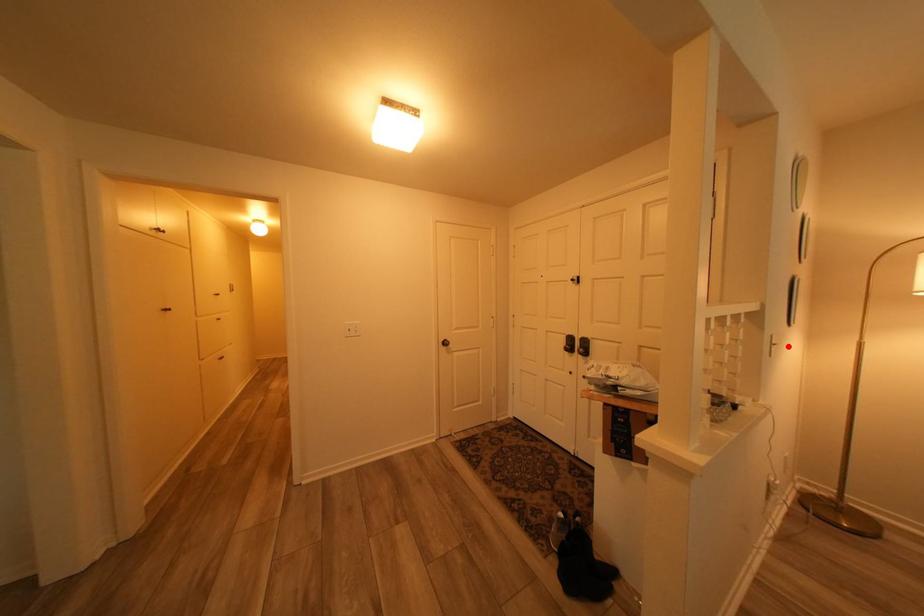
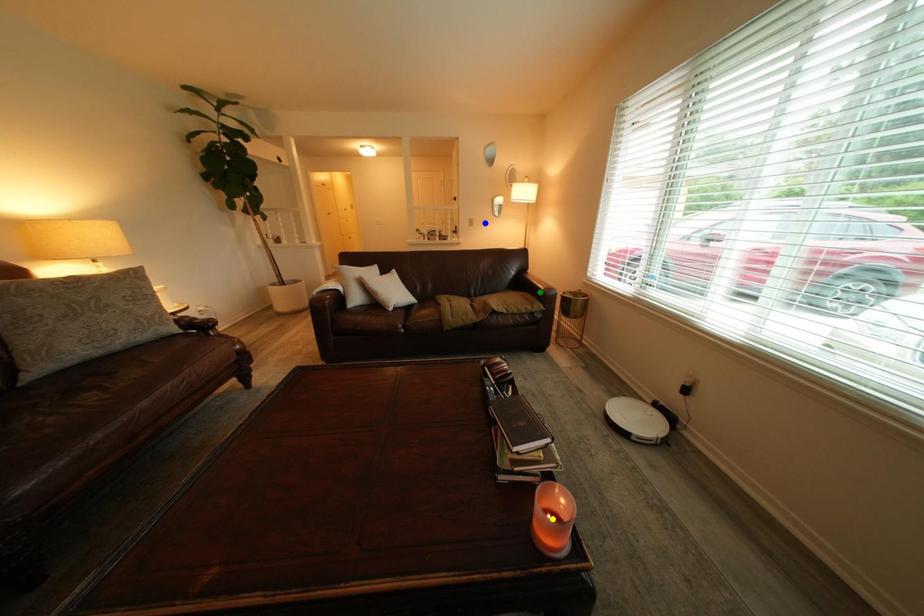
Question: I am providing you with two images of the same scene from different viewpoints. A red point is marked on the first image. You are given multiple points on the second image. Can you choose the point in image 2 that corresponds to the point in image 1?

Choices:
 (A) yellow point
 (B) green point
 (C) blue point

Answer: (C)